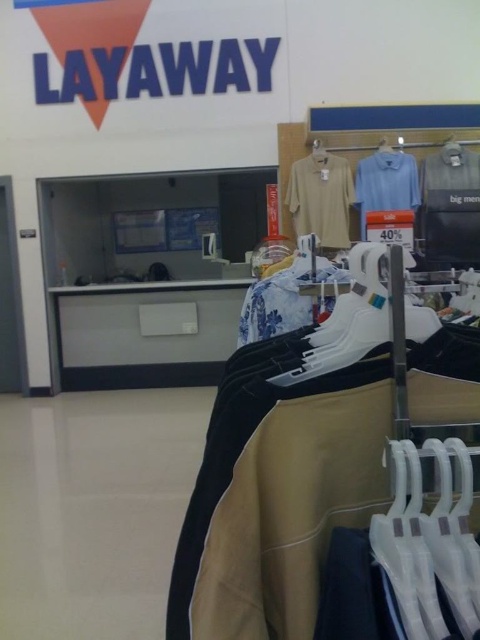
Question: Which of these objects is positioned closest to the beige fabric shirt at center?

Choices:
 (A) white plastic hanger at center
 (B) floral cotton shirt at center
 (C) white plastic hanger at upper center

Answer: (C)

Question: Does floral cotton shirt at center have a greater width compared to light blue cotton shirt at center?

Choices:
 (A) yes
 (B) no

Answer: (B)

Question: Is white plastic hanger at center to the right of light blue cotton shirt at center from the viewer's perspective?

Choices:
 (A) no
 (B) yes

Answer: (A)

Question: Can you confirm if white plastic hanger at center is positioned above white plastic hanger at upper center?

Choices:
 (A) yes
 (B) no

Answer: (B)

Question: Considering the real-world distances, which object is farthest from the white plastic hanger at center?

Choices:
 (A) light blue cotton shirt at center
 (B) white plastic hanger at upper center

Answer: (B)

Question: Which point is closer to the camera taking this photo?

Choices:
 (A) (327, 180)
 (B) (324, 160)

Answer: (B)